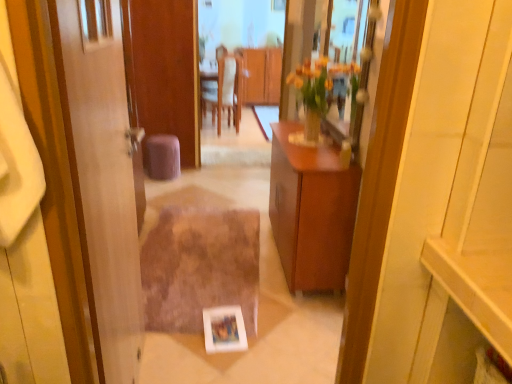
Find the location of a particular element. This screenshot has height=384, width=512. vacant region under brown shaggy rug at center (from a real-world perspective) is located at coordinates (197, 269).